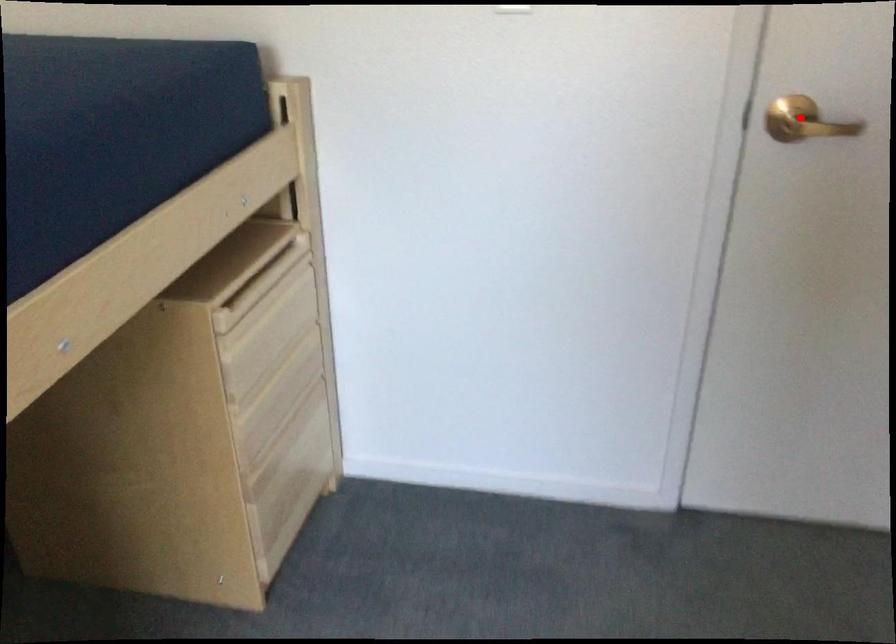
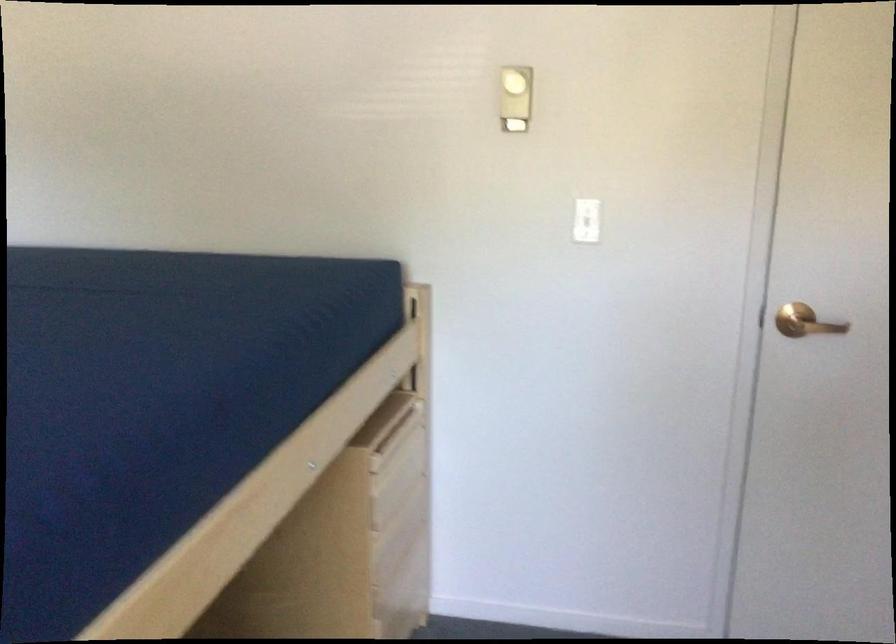
In the second image, find the point that corresponds to the highlighted location in the first image.

(805, 322)